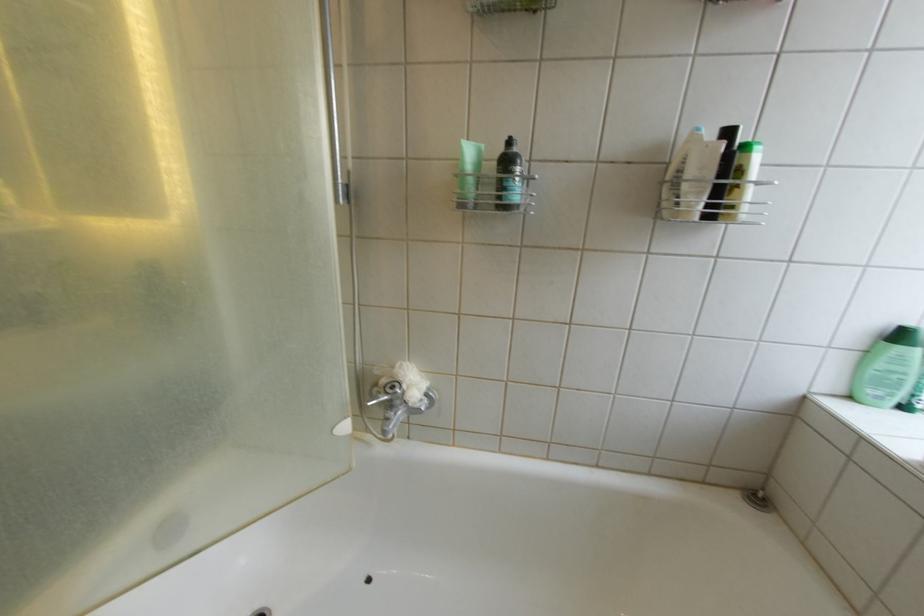
This screenshot has width=924, height=616. Identify the location of black pump dispenser. (508, 177).